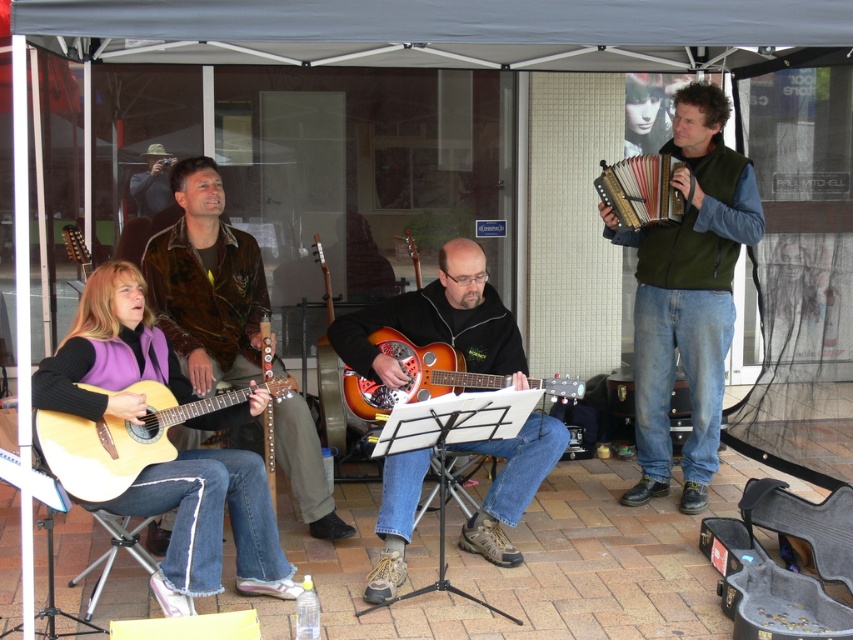
You are a photographer setting up for the performance. You need to position your camera so that both the matte purple vest at lower left and the matte brown acoustic guitar at left are in frame. Based on their positions, which object should you place closer to the left side of the camera frame?

The matte brown acoustic guitar at left should be placed closer to the left side of the camera frame since the matte purple vest at lower left is to the right of it, meaning the guitar is positioned further left.

You are a photographer trying to capture the brushed leather jacket at upper left and the matte brown acoustic guitar at left in a single shot. Which object should you focus on first to ensure both are in frame?

The brushed leather jacket at upper left is positioned under the matte brown acoustic guitar at left, so focusing on the matte brown acoustic guitar at left first will ensure both are captured in the frame.